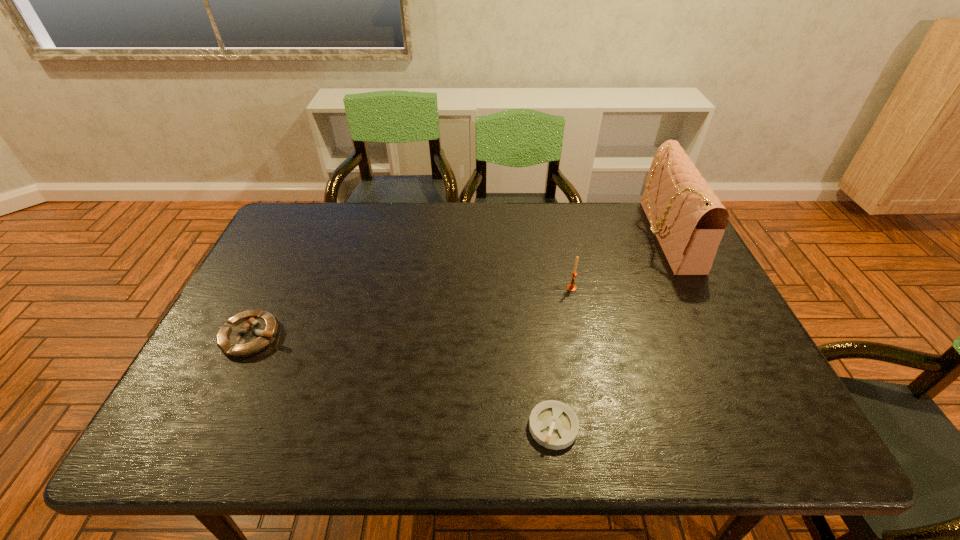
You are a GUI agent. You are given a task and a screenshot of the screen. Output one action in this format:
    pyautogui.click(x=<x>, y=<y>)
    Task: Click on the tallest object
    
    Given the screenshot: What is the action you would take?
    pyautogui.click(x=688, y=219)

Where is `the farthest object`? the farthest object is located at coordinates (688, 219).

At what (x,y) coordinates should I click in order to perform the action: click on the second farthest object. Please return your answer as a coordinate pair (x, y). Looking at the image, I should click on (571, 287).

The image size is (960, 540). I want to click on the third object from left to right, so click(571, 287).

This screenshot has height=540, width=960. Find the location of `the farther ashtray`. the farther ashtray is located at coordinates (247, 333).

The width and height of the screenshot is (960, 540). Find the location of `the second nearest object`. the second nearest object is located at coordinates (247, 333).

Where is `the nearest object`? the nearest object is located at coordinates (553, 424).

Where is `the shorter ashtray`? The height and width of the screenshot is (540, 960). the shorter ashtray is located at coordinates coord(553,424).

Find the location of a particular element. This screenshot has height=540, width=960. vacant space located 0.160m on the front-facing side of the handbag is located at coordinates (594, 235).

Image resolution: width=960 pixels, height=540 pixels. Find the location of `free space located 0.370m on the front-facing side of the handbag`. free space located 0.370m on the front-facing side of the handbag is located at coordinates (529, 235).